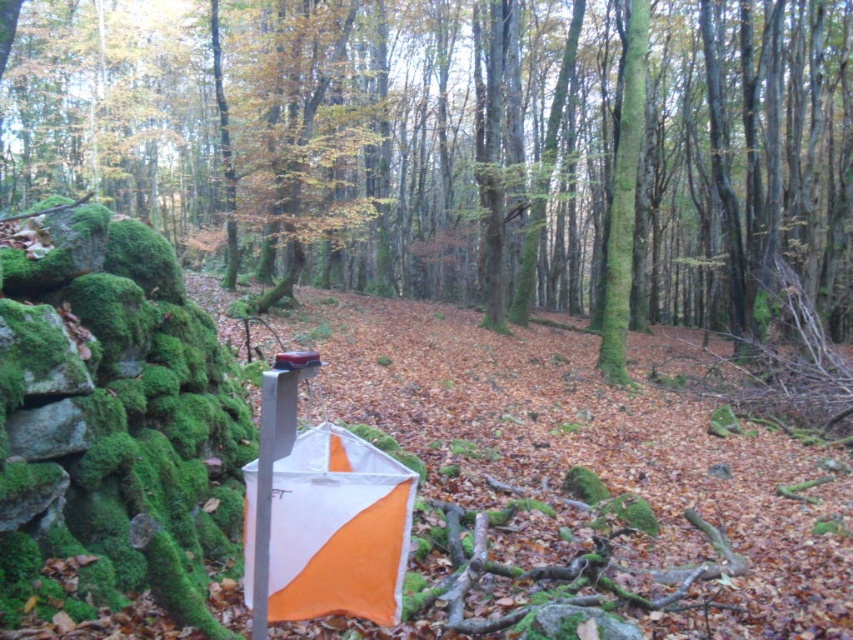
Who is taller, orange fabric umbrella at center or green mossy tree at center?

green mossy tree at center is taller.

Can you confirm if orange fabric umbrella at center is smaller than green mossy tree at center?

Indeed, orange fabric umbrella at center has a smaller size compared to green mossy tree at center.

Who is more forward, (398,573) or (622,196)?

Answer: Point (398,573)

I want to click on orange fabric umbrella at center, so coord(338,529).